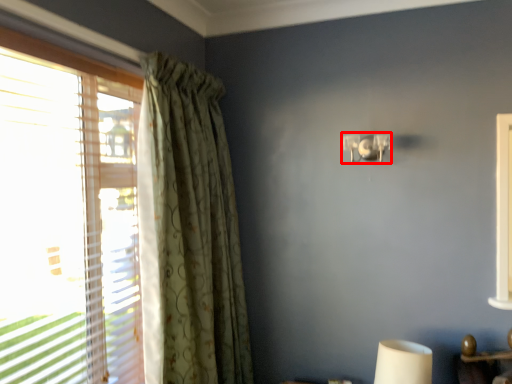
Question: From the image's perspective, where is lamp (annotated by the red box) located in relation to curtain in the image?

Choices:
 (A) below
 (B) above

Answer: (B)